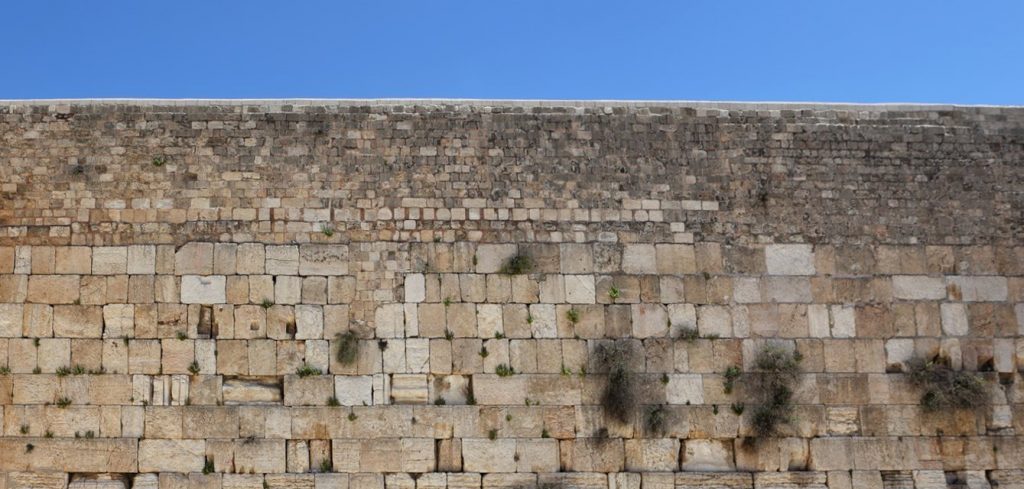
I want to click on wall, so click(692, 162).